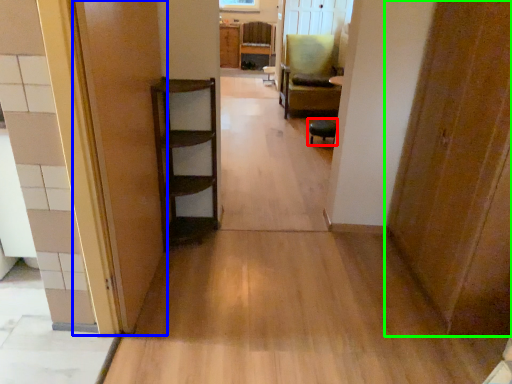
Question: Which is farther away from furniture (highlighted by a red box)? door (highlighted by a blue box) or door (highlighted by a green box)?

Choices:
 (A) door
 (B) door

Answer: (A)